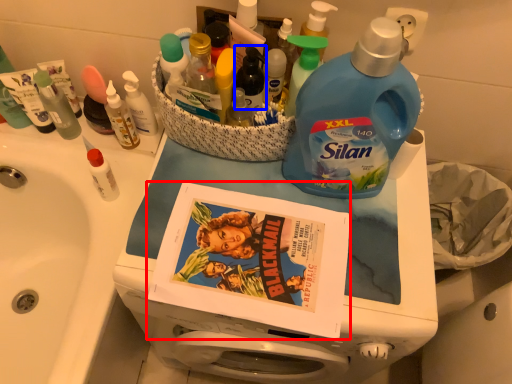
Question: Which of the following is the closest to the observer, comic book (highlighted by a red box) or bottle (highlighted by a blue box)?

Choices:
 (A) comic book
 (B) bottle

Answer: (A)